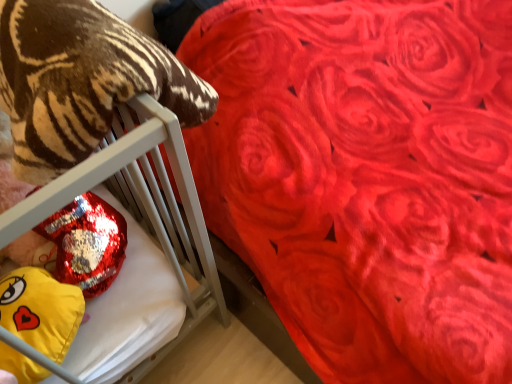
Question: Does soft plush tiger at left have a lesser width compared to shiny metallic pillow at left?

Choices:
 (A) no
 (B) yes

Answer: (B)

Question: From a real-world perspective, is soft plush tiger at left physically below shiny metallic pillow at left?

Choices:
 (A) yes
 (B) no

Answer: (B)

Question: Is shiny metallic pillow at left inside soft plush tiger at left?

Choices:
 (A) yes
 (B) no

Answer: (B)

Question: Can you confirm if soft plush tiger at left is wider than shiny metallic pillow at left?

Choices:
 (A) no
 (B) yes

Answer: (A)

Question: Is soft plush tiger at left at the left side of shiny metallic pillow at left?

Choices:
 (A) yes
 (B) no

Answer: (B)

Question: Is soft plush tiger at left further to camera compared to shiny metallic pillow at left?

Choices:
 (A) no
 (B) yes

Answer: (A)

Question: Is shiny metallic pillow at left turned away from soft plush tiger at left?

Choices:
 (A) yes
 (B) no

Answer: (B)

Question: Is the position of shiny metallic pillow at left more distant than that of soft plush tiger at left?

Choices:
 (A) no
 (B) yes

Answer: (B)

Question: Is shiny metallic pillow at left located outside soft plush tiger at left?

Choices:
 (A) yes
 (B) no

Answer: (A)

Question: Considering the relative sizes of shiny metallic pillow at left and soft plush tiger at left in the image provided, is shiny metallic pillow at left bigger than soft plush tiger at left?

Choices:
 (A) yes
 (B) no

Answer: (B)

Question: Can you confirm if shiny metallic pillow at left is wider than soft plush tiger at left?

Choices:
 (A) yes
 (B) no

Answer: (A)

Question: Does shiny metallic pillow at left have a greater height compared to soft plush tiger at left?

Choices:
 (A) no
 (B) yes

Answer: (A)

Question: Considering the relative sizes of yellow plush at left and soft plush tiger at left in the image provided, is yellow plush at left wider than soft plush tiger at left?

Choices:
 (A) yes
 (B) no

Answer: (B)